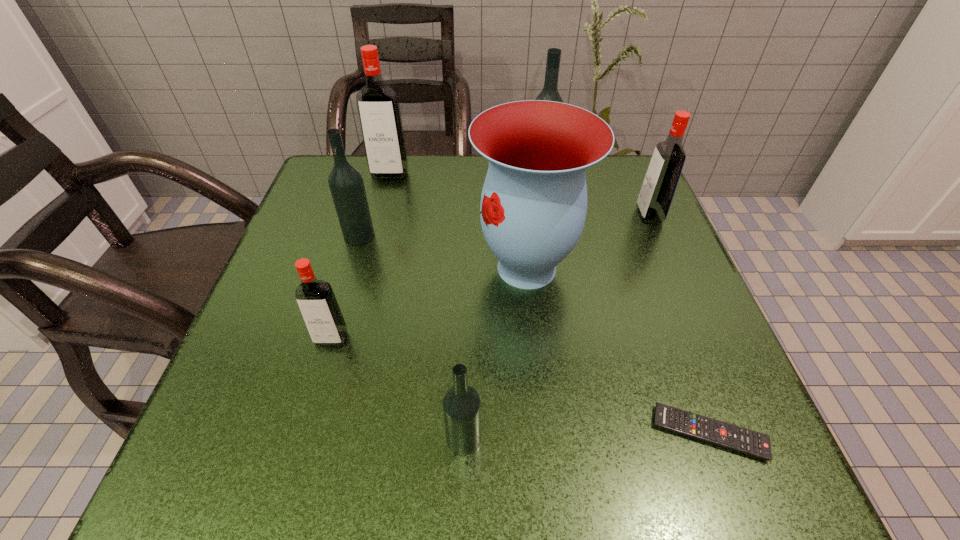
Where is `empty space between the red vase and the rightmost red vodka`? empty space between the red vase and the rightmost red vodka is located at coordinates (588, 242).

You are a GUI agent. You are given a task and a screenshot of the screen. Output one action in this format:
    pyautogui.click(x=<x>, y=<y>)
    Task: Click on the free spot between the third vodka from right to left and the nearest red vodka
    Image resolution: width=960 pixels, height=540 pixels.
    Given the screenshot: What is the action you would take?
    pyautogui.click(x=397, y=389)

The image size is (960, 540). I want to click on blank region between the fourth vodka from left to right and the vase, so click(495, 353).

At what (x,y) coordinates should I click in order to perform the action: click on the fourth closest object to the shortest object. Please return your answer as a coordinate pair (x, y). Image resolution: width=960 pixels, height=540 pixels. Looking at the image, I should click on (316, 300).

Identify which object is the second nearest to the second biggest red vodka. Please provide its 2D coordinates. Your answer should be formatted as a tuple, i.e. [(x, y)], where the tuple contains the x and y coordinates of a point satisfying the conditions above.

[(549, 92)]

At what (x,y) coordinates should I click in order to perform the action: click on vodka object that ranks as the second closest to the farthest black vodka. Please return your answer as a coordinate pair (x, y). Image resolution: width=960 pixels, height=540 pixels. Looking at the image, I should click on (378, 107).

Find the location of a particular element. the third closest vodka to the rightmost vodka is located at coordinates (461, 404).

Identify which black vodka is located as the nearest to the second farthest black vodka. Please provide its 2D coordinates. Your answer should be formatted as a tuple, i.e. [(x, y)], where the tuple contains the x and y coordinates of a point satisfying the conditions above.

[(549, 92)]

Select which black vodka is the closest to the third nearest object. Please provide its 2D coordinates. Your answer should be formatted as a tuple, i.e. [(x, y)], where the tuple contains the x and y coordinates of a point satisfying the conditions above.

[(346, 184)]

The image size is (960, 540). What are the coordinates of `red vodka object that ranks as the third closest to the second farthest black vodka` in the screenshot? It's located at (660, 182).